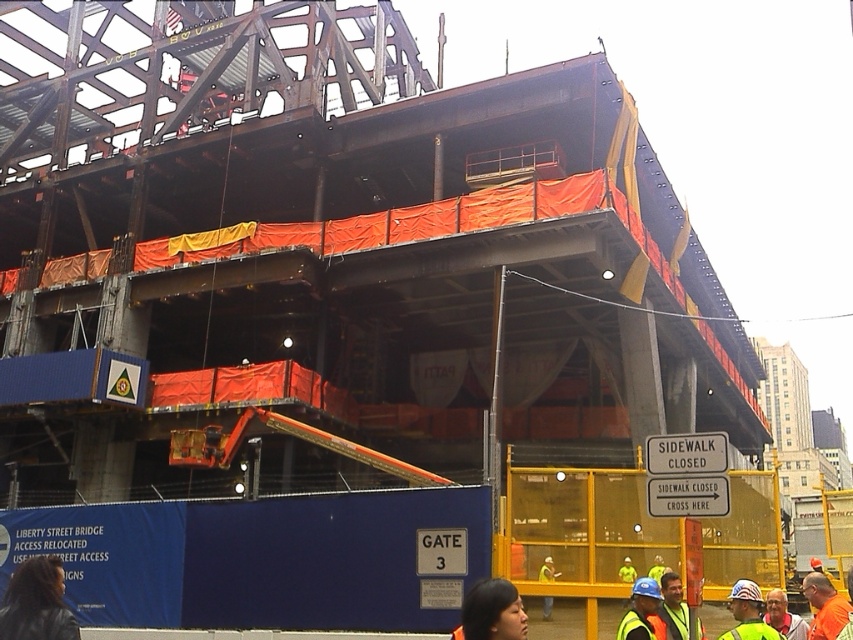
Question: Which of the following is the farthest from the observer?

Choices:
 (A) reflective yellow vest at center
 (B) orange safety vest at lower right
 (C) orange reflective vest at lower right

Answer: (B)

Question: Is reflective yellow vest at center behind reflective safety vest at center?

Choices:
 (A) no
 (B) yes

Answer: (A)

Question: Is reflective safety vest at center closer to camera compared to orange safety vest at lower right?

Choices:
 (A) yes
 (B) no

Answer: (A)

Question: Which object is the farthest from the orange safety vest at lower right?

Choices:
 (A) orange reflective vest at lower right
 (B) reflective safety vest at center

Answer: (B)

Question: Is reflective safety vest at center positioned before orange safety vest at lower right?

Choices:
 (A) yes
 (B) no

Answer: (A)

Question: Among these points, which one is farthest from the camera?

Choices:
 (A) (668, 611)
 (B) (827, 588)

Answer: (B)